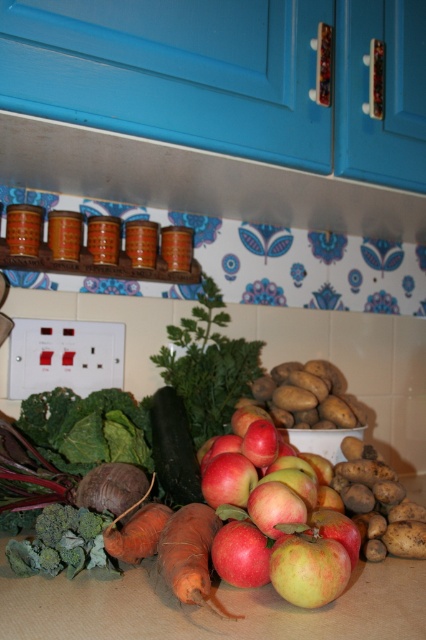
You are arranging fruits and vegetables on a kitchen counter. You have the red matte apples at center and the green matte cucumber at center. Which object is positioned lower on the counter?

The red matte apples at center are positioned lower on the counter than the green matte cucumber at center.

You are organizing a fruit basket and need to know which item takes up more space on the counter. Based on the scene, which object is wider between the red matte apples at center and the orange matte carrot at center?

The red matte apples at center are wider than the orange matte carrot at center, so they take up more space on the counter.